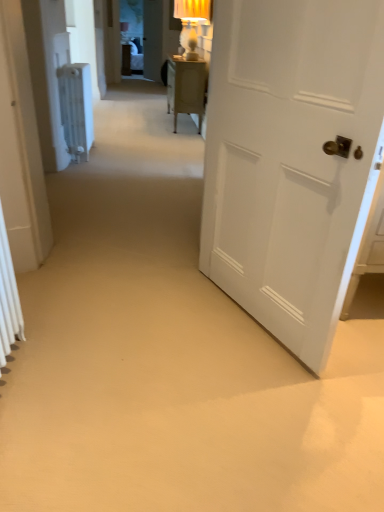
Question: Is white plastic radiator at left turned away from white matte door at right, which is counted as the 2th door, starting from the back?

Choices:
 (A) yes
 (B) no

Answer: (B)

Question: Is white plastic radiator at left in contact with white matte door at right, the 1th door viewed from the right?

Choices:
 (A) yes
 (B) no

Answer: (B)

Question: Does white plastic radiator at left contain white matte door at right, acting as the second door starting from the left?

Choices:
 (A) no
 (B) yes

Answer: (A)

Question: From a real-world perspective, is white plastic radiator at left beneath white matte door at right, which is counted as the 2th door, starting from the back?

Choices:
 (A) yes
 (B) no

Answer: (A)

Question: Considering the relative sizes of white plastic radiator at left and white matte door at right, which is counted as the 2th door, starting from the back, in the image provided, is white plastic radiator at left taller than white matte door at right, which is counted as the 2th door, starting from the back,?

Choices:
 (A) no
 (B) yes

Answer: (A)

Question: Considering the relative positions of white plastic radiator at left and white matte door at right, acting as the second door starting from the left, in the image provided, is white plastic radiator at left to the left of white matte door at right, acting as the second door starting from the left, from the viewer's perspective?

Choices:
 (A) yes
 (B) no

Answer: (A)

Question: Can you confirm if white matte radiator at left, which is the second door in front-to-back order, is bigger than white matte door at right, the 1th door viewed from the right?

Choices:
 (A) no
 (B) yes

Answer: (A)

Question: Considering the relative sizes of white matte radiator at left, which is counted as the first door, starting from the back, and white matte door at right, which is counted as the 2th door, starting from the back, in the image provided, is white matte radiator at left, which is counted as the first door, starting from the back, thinner than white matte door at right, which is counted as the 2th door, starting from the back,?

Choices:
 (A) no
 (B) yes

Answer: (B)

Question: From the image's perspective, would you say white matte radiator at left, which is counted as the first door, starting from the back, is positioned over white matte door at right, acting as the second door starting from the left?

Choices:
 (A) no
 (B) yes

Answer: (B)

Question: From a real-world perspective, is white matte radiator at left, which is counted as the first door, starting from the back, located beneath white matte door at right, which is the 1th door in front-to-back order?

Choices:
 (A) no
 (B) yes

Answer: (A)

Question: Is white matte radiator at left, acting as the first door starting from the left, facing away from white matte door at right, which is counted as the 2th door, starting from the back?

Choices:
 (A) yes
 (B) no

Answer: (B)

Question: Is white matte radiator at left, acting as the first door starting from the left, taller than white matte door at right, which is counted as the 2th door, starting from the back?

Choices:
 (A) yes
 (B) no

Answer: (B)

Question: Is white matte radiator at left, acting as the first door starting from the left, to the left of white plastic radiator at left from the viewer's perspective?

Choices:
 (A) no
 (B) yes

Answer: (B)